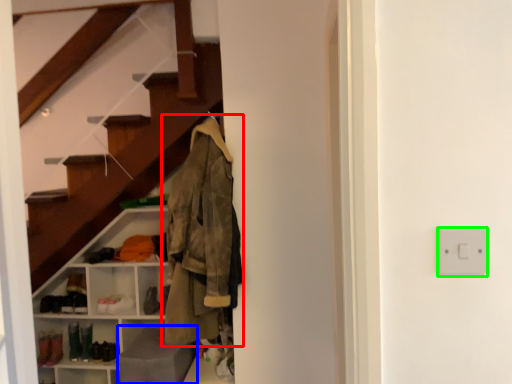
Question: Based on their relative distances, which object is farther from jacket (highlighted by a red box)? Choose from gray (highlighted by a blue box) and electric outlet (highlighted by a green box).

Choices:
 (A) gray
 (B) electric outlet

Answer: (B)